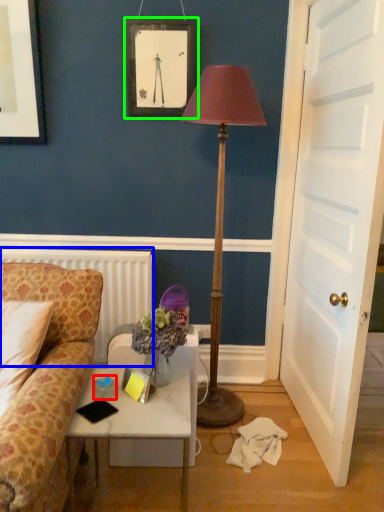
Question: Which is farther away from coffee cup (highlighted by a red box)? radiator (highlighted by a blue box) or picture frame (highlighted by a green box)?

Choices:
 (A) radiator
 (B) picture frame

Answer: (B)